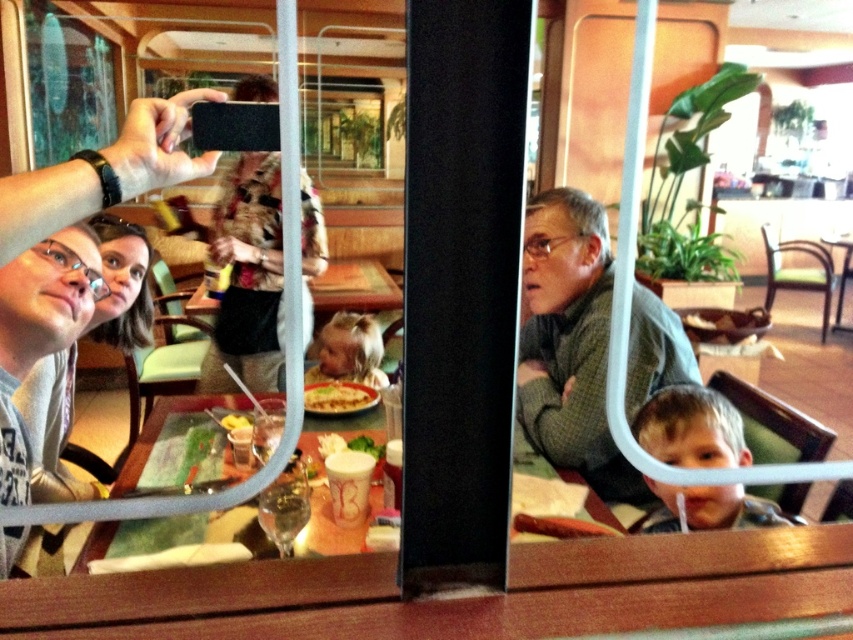
Question: Is floral-patterned blouse at center smaller than blonde hair at center?

Choices:
 (A) yes
 (B) no

Answer: (B)

Question: Does blonde hair boy at lower right have a lesser width compared to yellow cheese at center?

Choices:
 (A) yes
 (B) no

Answer: (B)

Question: Which object appears farthest from the camera in this image?

Choices:
 (A) yellow cheese at center
 (B) floral-patterned blouse at center
 (C) blonde hair boy at lower right
 (D) blonde hair at center

Answer: (B)

Question: Does green textured sweater at center have a greater width compared to blonde hair boy at lower right?

Choices:
 (A) yes
 (B) no

Answer: (A)

Question: Which object is the closest to the floral-patterned blouse at center?

Choices:
 (A) green textured sweater at center
 (B) yellowish matte sandwich at center
 (C) yellow cheese at center

Answer: (B)

Question: Which point is closer to the camera?

Choices:
 (A) blonde hair boy at lower right
 (B) yellow cheese at center
 (C) floral-patterned blouse at center
 (D) green textured sweater at center

Answer: (A)